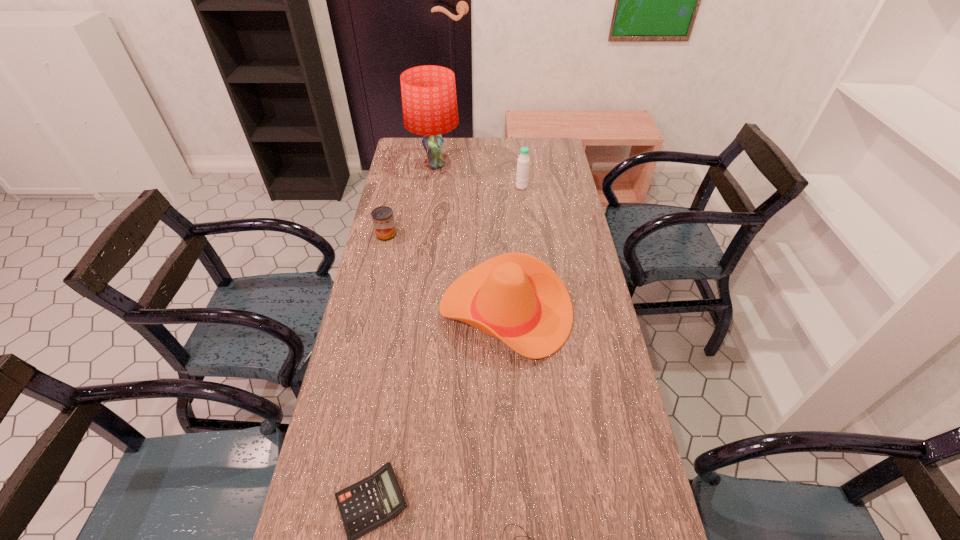
In order to click on object situated at the far edge in this screenshot , I will do `click(429, 102)`.

Where is `lampshade positioned at the left edge`? This screenshot has height=540, width=960. lampshade positioned at the left edge is located at coordinates (429, 102).

Identify the location of can present at the left edge. (383, 220).

The height and width of the screenshot is (540, 960). I want to click on object located in the right edge section of the desktop, so click(515, 297).

Where is `object present at the far left corner`? Image resolution: width=960 pixels, height=540 pixels. object present at the far left corner is located at coordinates (429, 102).

Identify the location of vacant space at the left edge of the desktop. (374, 293).

Locate an element on the screen. vacant space at the right edge of the desktop is located at coordinates (555, 180).

In the image, there is a desktop. Identify the location of free region at the far left corner. This screenshot has width=960, height=540. (405, 145).

I want to click on vacant space at the far right corner of the desktop, so click(x=533, y=140).

Where is `free space that is in between the third nearest object and the water bottle`? free space that is in between the third nearest object and the water bottle is located at coordinates (514, 249).